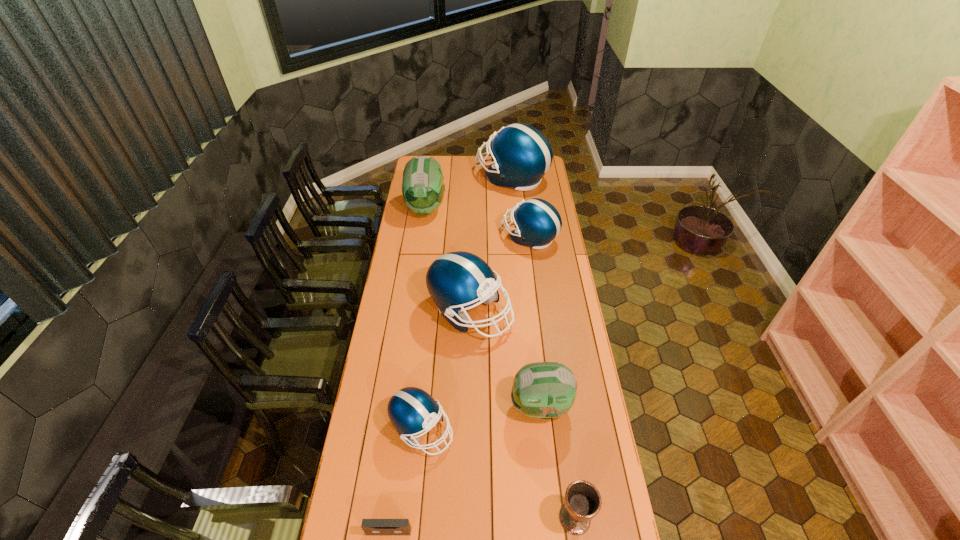
This screenshot has width=960, height=540. I want to click on vacant position in the image that satisfies the following two spatial constraints: 1. at the front of the tallest football helmet with the faceguard; 2. on the visor of the left green football helmet, so click(x=515, y=208).